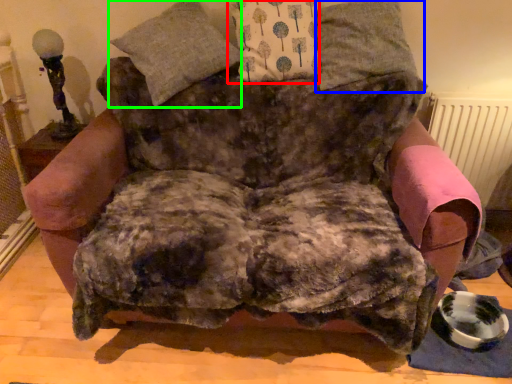
Question: Based on their relative distances, which object is nearer to pillow (highlighted by a red box)? Choose from pillow (highlighted by a blue box) and pillow (highlighted by a green box).

Choices:
 (A) pillow
 (B) pillow

Answer: (A)